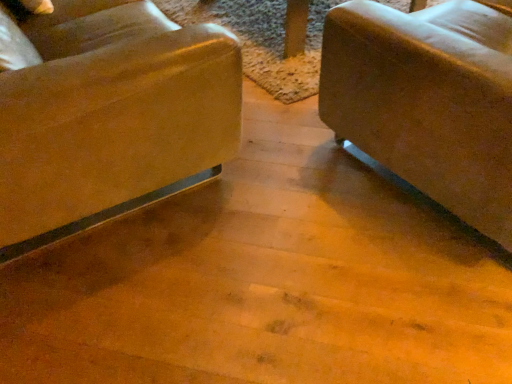
Question: In terms of size, does suede-like beige couch at right appear bigger or smaller than matte brown chair at left?

Choices:
 (A) small
 (B) big

Answer: (A)

Question: Considering the positions of suede-like beige couch at right and matte brown chair at left in the image, is suede-like beige couch at right taller or shorter than matte brown chair at left?

Choices:
 (A) tall
 (B) short

Answer: (B)

Question: Is point (x=413, y=109) positioned closer to the camera than point (x=41, y=23)?

Choices:
 (A) closer
 (B) farther

Answer: (A)

Question: Would you say matte brown chair at left is to the left or to the right of suede-like beige couch at right in the picture?

Choices:
 (A) right
 (B) left

Answer: (B)

Question: Is matte brown chair at left taller or shorter than suede-like beige couch at right?

Choices:
 (A) tall
 (B) short

Answer: (A)

Question: Is matte brown chair at left inside the boundaries of suede-like beige couch at right, or outside?

Choices:
 (A) inside
 (B) outside

Answer: (B)

Question: Is matte brown chair at left in front of or behind suede-like beige couch at right in the image?

Choices:
 (A) front
 (B) behind

Answer: (A)